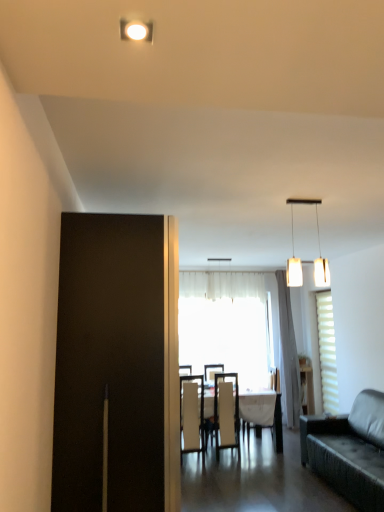
Question: Is white sheer curtain at center in front of or behind leather couch at right in the image?

Choices:
 (A) front
 (B) behind

Answer: (B)

Question: Does point (279, 309) appear closer or farther from the camera than point (316, 423)?

Choices:
 (A) closer
 (B) farther

Answer: (B)

Question: Which object is positioned farthest from the white fabric chair at center, which is counted as the first chair, starting from the right?

Choices:
 (A) translucent fabric window at center, positioned as the 2th window in right-to-left order
 (B) matte white cabinet at right
 (C) leather couch at right
 (D) white fabric chair at center, arranged as the third chair when viewed from the right
 (E) white sheer curtain at center

Answer: (C)

Question: Which object is positioned closest to the white leather chair at center, which appears as the 2th chair when viewed from the right?

Choices:
 (A) white matte pendant lights at upper center
 (B) white sheer curtain at center
 (C) white fabric chair at center, the first chair from the left
 (D) white fabric chair at center, which is counted as the first chair, starting from the right
 (E) white glossy table at center

Answer: (E)